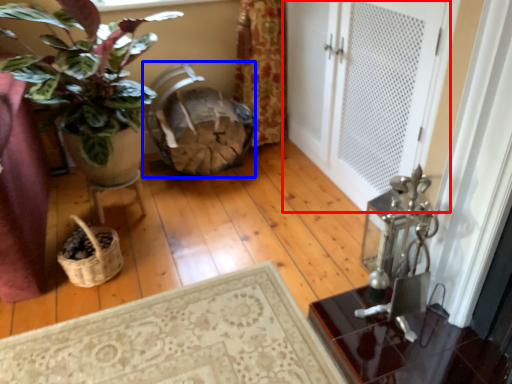
Question: Among these objects, which one is nearest to the camera, door (highlighted by a red box) or rocking chair (highlighted by a blue box)?

Choices:
 (A) door
 (B) rocking chair

Answer: (A)